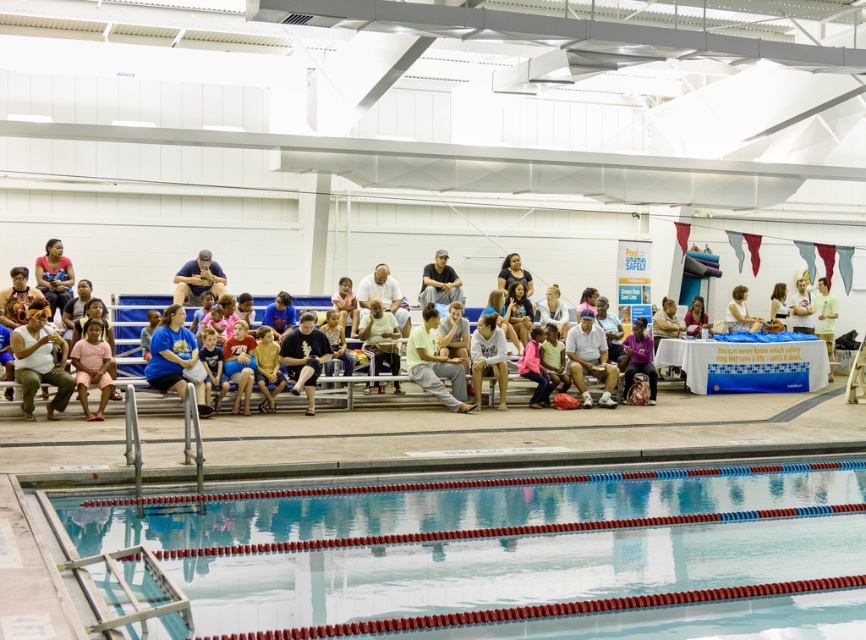
Who is positioned more to the right, white cotton tank top at left or dark gray pants at center?

dark gray pants at center

The width and height of the screenshot is (866, 640). Describe the element at coordinates (39, 360) in the screenshot. I see `white cotton tank top at left` at that location.

What do you see at coordinates (39, 360) in the screenshot? The height and width of the screenshot is (640, 866). I see `white cotton tank top at left` at bounding box center [39, 360].

Identify the location of white cotton tank top at left. This screenshot has width=866, height=640. (39, 360).

Between clear plastic pool at lower center and white cotton tank top at left, which one is positioned higher?

white cotton tank top at left is higher up.

Which is behind, point (786, 472) or point (65, 352)?

The point (65, 352) is behind.

The width and height of the screenshot is (866, 640). Find the location of `clear plastic pool at lower center`. clear plastic pool at lower center is located at coordinates (514, 554).

Is light yellow fabric shirt at center smaller than matte blue shirt at center?

Incorrect, light yellow fabric shirt at center is not smaller in size than matte blue shirt at center.

Which is behind, point (421, 378) or point (210, 266)?

The point (210, 266) is more distant.

Locate an element on the screen. This screenshot has height=640, width=866. light yellow fabric shirt at center is located at coordinates (434, 364).